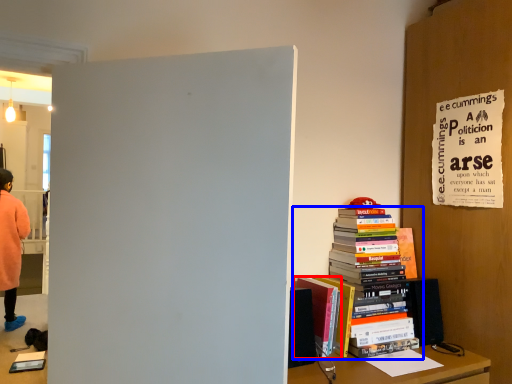
Question: Which object appears farthest to the camera in this image, book (highlighted by a red box) or book (highlighted by a blue box)?

Choices:
 (A) book
 (B) book

Answer: (B)